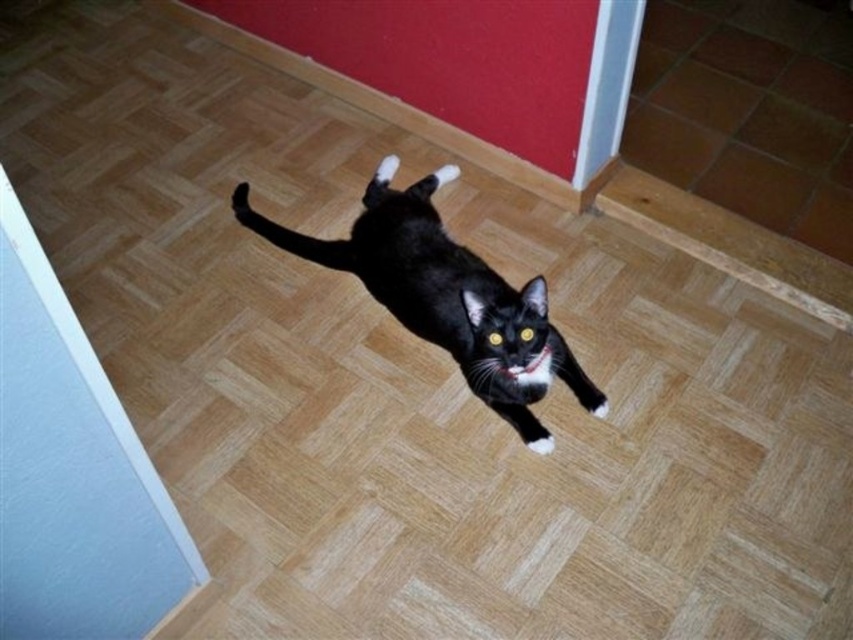
Question: In this image, where is black matte paw at center located relative to white fur paw at center?

Choices:
 (A) left
 (B) right

Answer: (A)

Question: Among these objects, which one is farthest from the camera?

Choices:
 (A) black matte paw at center
 (B) white fur paw at center
 (C) black glossy cat at center

Answer: (A)

Question: Which object appears closest to the camera in this image?

Choices:
 (A) black glossy cat at center
 (B) black matte paw at center
 (C) white fur paw at center

Answer: (A)

Question: Which object is positioned closest to the black glossy cat at center?

Choices:
 (A) white fur paw at center
 (B) black matte paw at center

Answer: (A)

Question: Can you confirm if black glossy cat at center is positioned above black matte paw at center?

Choices:
 (A) no
 (B) yes

Answer: (A)

Question: Observing the image, what is the correct spatial positioning of black glossy cat at center in reference to white fur paw at center?

Choices:
 (A) below
 (B) above

Answer: (B)